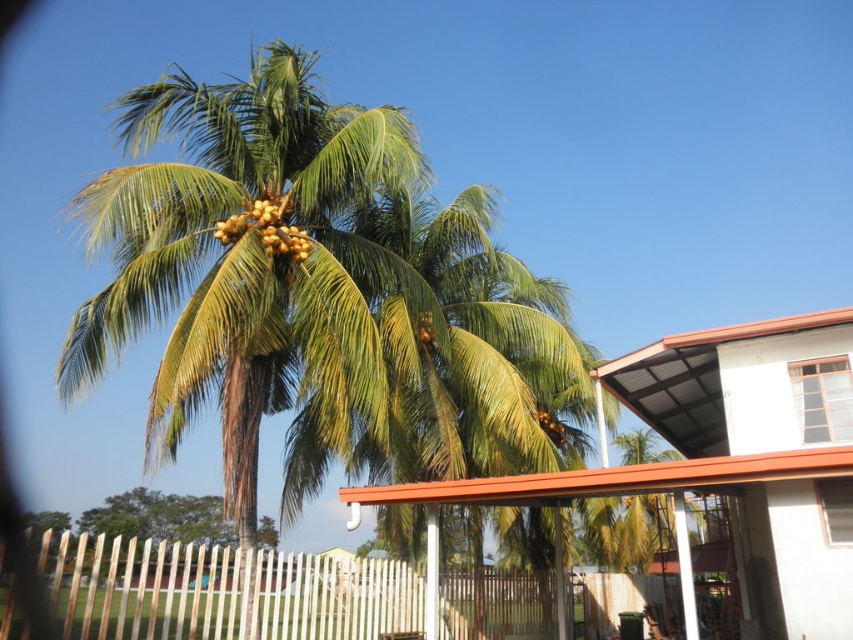
Is point (682, 451) positioned before point (260, 538)?

Yes, it is in front of point (260, 538).

Between brown corrugated metal roof at upper center and green leafy palm at lower left, which one appears on the left side from the viewer's perspective?

From the viewer's perspective, green leafy palm at lower left appears more on the left side.

Locate an element on the screen. The height and width of the screenshot is (640, 853). brown corrugated metal roof at upper center is located at coordinates (718, 465).

Which of these two, brown corrugated metal roof at upper center or yellow matte coconut at center, stands shorter?

brown corrugated metal roof at upper center

Image resolution: width=853 pixels, height=640 pixels. I want to click on brown corrugated metal roof at upper center, so click(718, 465).

Can you confirm if white wooden fence at lower left is taller than yellow matte coconut at center?

Correct, white wooden fence at lower left is much taller as yellow matte coconut at center.

Is point (367, 589) positioned after point (416, 340)?

That is False.

Is point (315, 561) farther from camera compared to point (416, 323)?

No, it is in front of (416, 323).

Where is `white wooden fence at lower left`? white wooden fence at lower left is located at coordinates (224, 592).